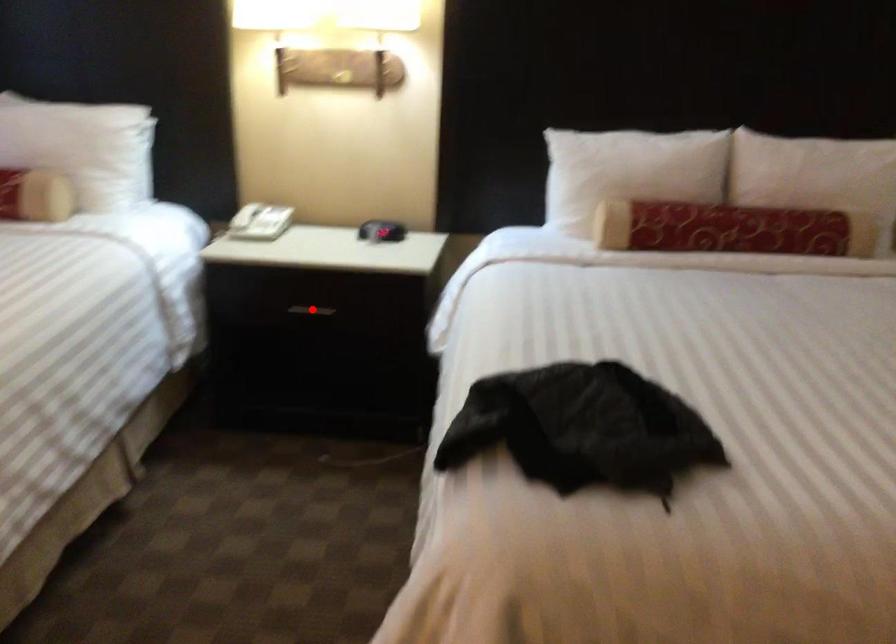
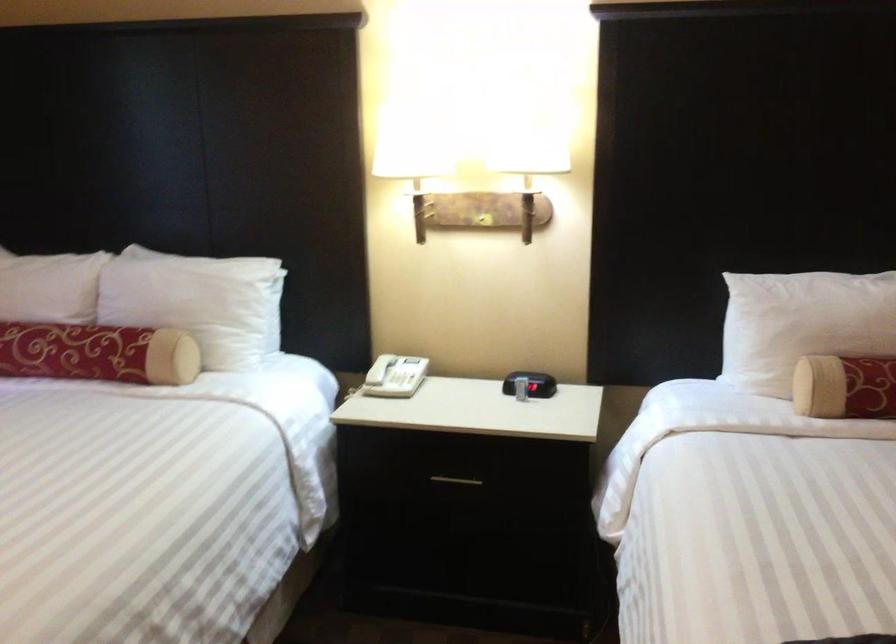
Find the pixel in the second image that matches the highlighted location in the first image.

(455, 480)